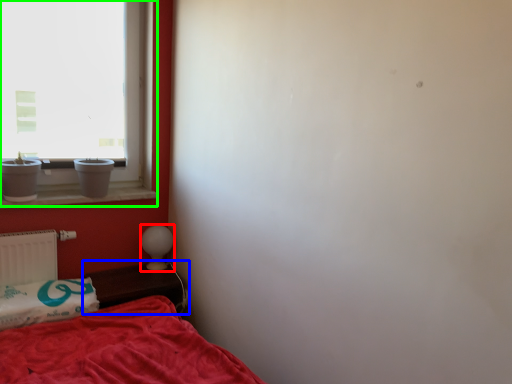
Question: Which object is positioned farthest from table lamp (highlighted by a red box)? Select from table (highlighted by a blue box) and window (highlighted by a green box).

Choices:
 (A) table
 (B) window

Answer: (B)